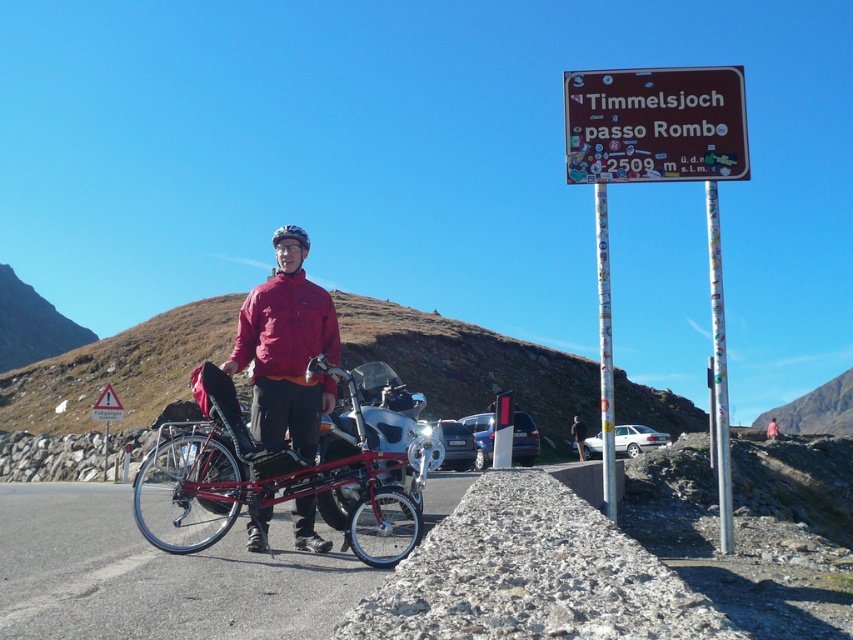
Is brown/stained wood sign at upper right above matte red jacket at center?

Indeed, brown/stained wood sign at upper right is positioned over matte red jacket at center.

Can you confirm if brown/stained wood sign at upper right is bigger than matte red jacket at center?

No.

Between point (734, 109) and point (254, 419), which one is positioned behind?

The point (734, 109) is behind.

Identify the location of brown/stained wood sign at upper right. (654, 124).

Who is more forward, [248,298] or [579,451]?

Point [248,298]

Is point (276, 404) behind point (577, 438)?

No, it is in front of (577, 438).

Where is `matte red jacket at center`? matte red jacket at center is located at coordinates (286, 348).

Which is behind, point (590, 90) or point (119, 404)?

Point (119, 404)

From the picture: Is brown/stained wood sign at upper right taller than yellow reflective triangle at upper left?

Yes.

Is point (619, 131) farther from camera compared to point (96, 400)?

No, it is in front of (96, 400).

I want to click on brown/stained wood sign at upper right, so click(654, 124).